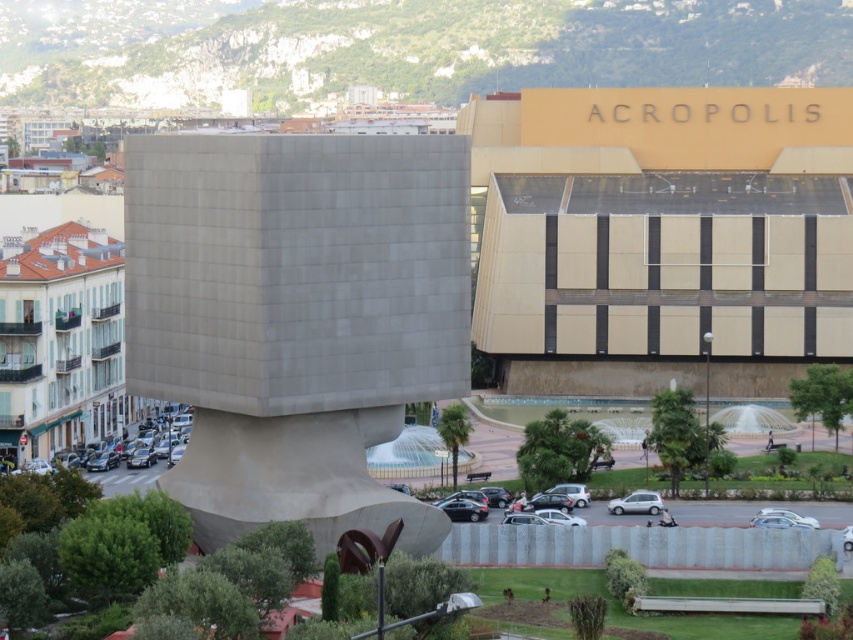
Can you confirm if silver metallic car at lower right is bigger than silver metallic car at center?

Yes.

Does point (769, 509) come farther from viewer compared to point (848, 532)?

Yes.

Is point (756, 515) positioned after point (851, 540)?

Yes, point (756, 515) is farther from viewer.

At what (x,y) coordinates should I click in order to perform the action: click on silver metallic car at lower right. Please return your answer as a coordinate pair (x, y). Looking at the image, I should click on click(788, 515).

Can you confirm if metallic silver car at center is positioned to the left of silver metallic car at lower right?

Correct, you'll find metallic silver car at center to the left of silver metallic car at lower right.

Does metallic silver car at center have a greater width compared to silver metallic car at lower right?

No, metallic silver car at center is not wider than silver metallic car at lower right.

What are the coordinates of `metallic silver car at center` in the screenshot? It's located at (572, 492).

Between point (148, 428) and point (581, 500), which one is positioned in front?

Point (581, 500) is in front.

Is shiny black car at lower left further to the viewer compared to metallic silver car at center?

Yes.

Is point (164, 445) behind point (575, 502)?

Yes.

At what (x,y) coordinates should I click in order to perform the action: click on shiny black car at lower left. Please return your answer as a coordinate pair (x, y). Looking at the image, I should click on (155, 440).